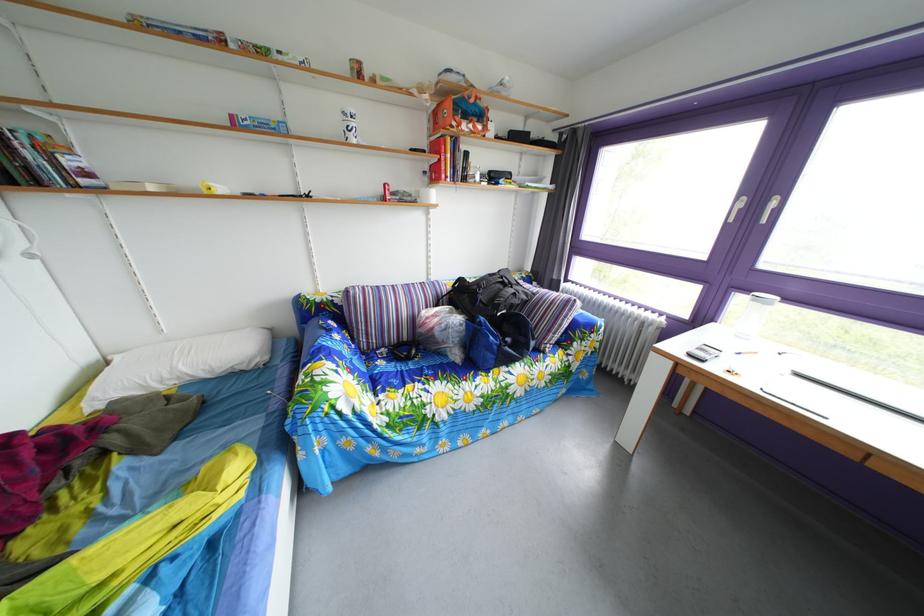
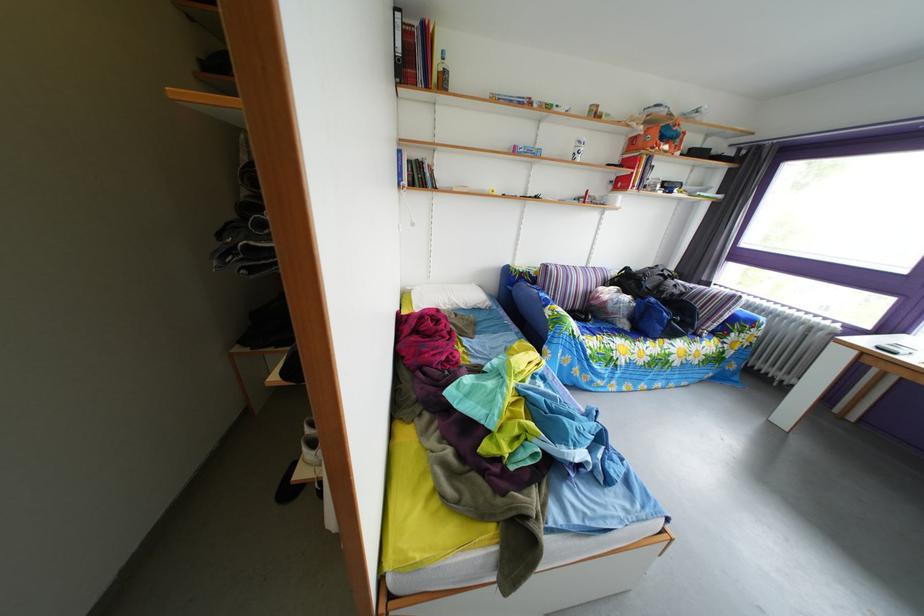
Locate, in the second image, the point that corresponds to pixel 476 124 in the first image.

(673, 147)